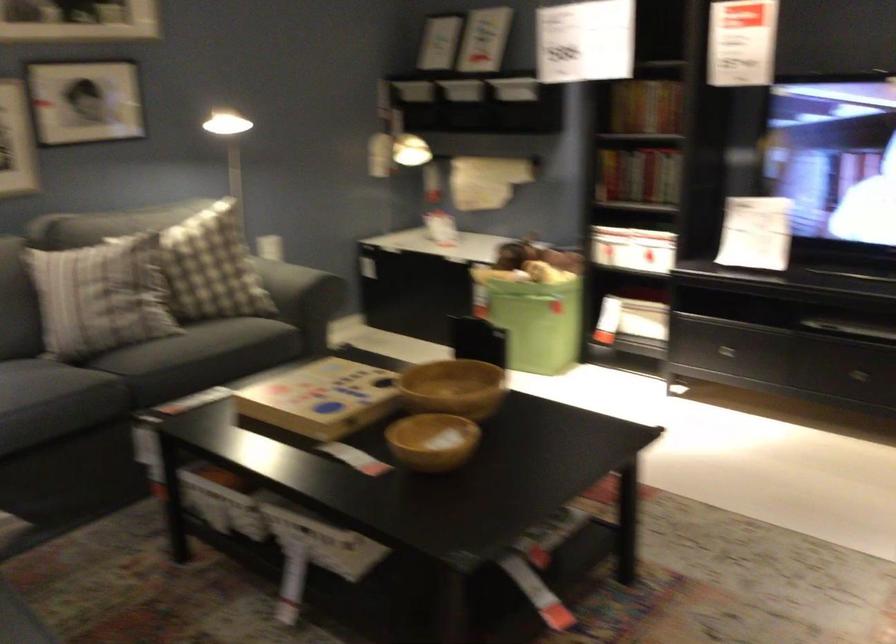
Locate an element on the screen. This screenshot has height=644, width=896. drawer handle is located at coordinates (711, 355).